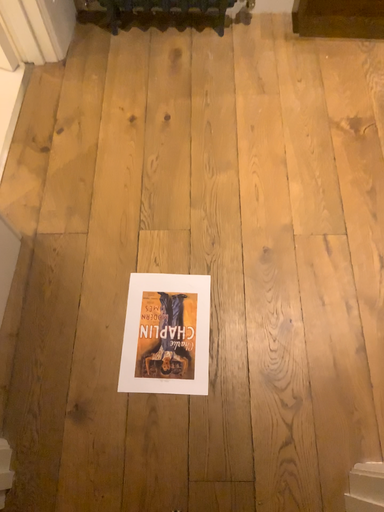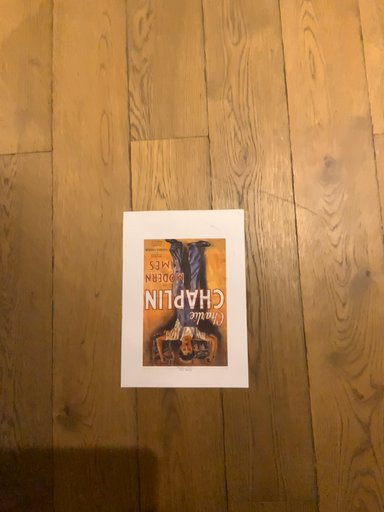
Question: Which way did the camera rotate in the video?

Choices:
 (A) rotated upward
 (B) rotated downward

Answer: (B)